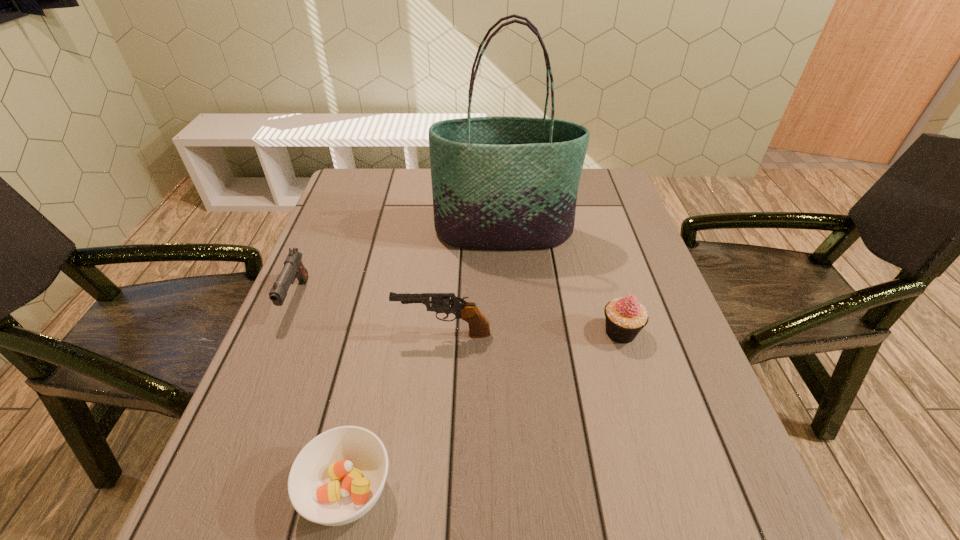
Locate an element on the screen. Image resolution: width=960 pixels, height=540 pixels. blank space located 0.110m along the barrel of the right gun is located at coordinates (346, 334).

Find the location of a particular element. This screenshot has width=960, height=540. free space located on the back of the cupcake is located at coordinates (607, 286).

Image resolution: width=960 pixels, height=540 pixels. What are the coordinates of `blank space located in the direction the shorter gun is aimed` in the screenshot? It's located at (247, 416).

Locate an element on the screen. object located at the left edge is located at coordinates (293, 268).

Find the location of a particular element. object present at the right edge is located at coordinates (625, 317).

Where is `vacant space at the far edge of the desktop`? vacant space at the far edge of the desktop is located at coordinates (426, 191).

In the image, there is a desktop. Where is `vacant space at the left edge`? vacant space at the left edge is located at coordinates (368, 241).

The image size is (960, 540). In order to click on vacant space at the right edge of the desktop in this screenshot , I will do `click(609, 236)`.

This screenshot has width=960, height=540. In the image, there is a desktop. Find the location of `vacant space at the far left corner`. vacant space at the far left corner is located at coordinates (393, 185).

I want to click on vacant space at the near left corner, so click(x=301, y=522).